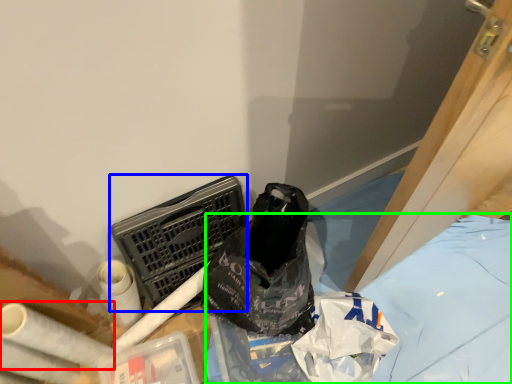
Question: Which object is the farthest from toilet paper (highlighted by a red box)? Choose among these: laundry basket (highlighted by a blue box) or sheet (highlighted by a green box).

Choices:
 (A) laundry basket
 (B) sheet

Answer: (B)